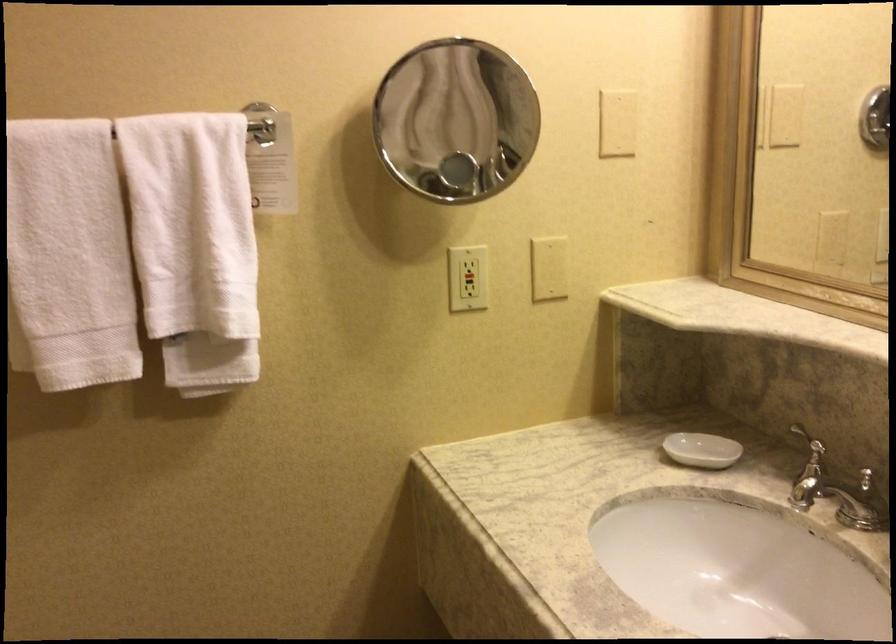
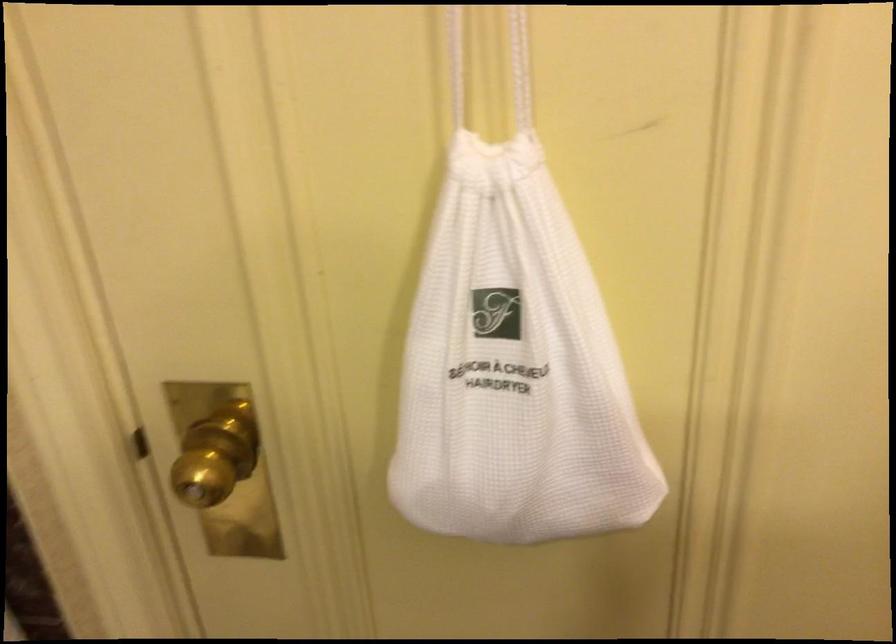
The first image is from the beginning of the video and the second image is from the end. How did the camera likely rotate when shooting the video?

The rotation direction of the camera is left-down.